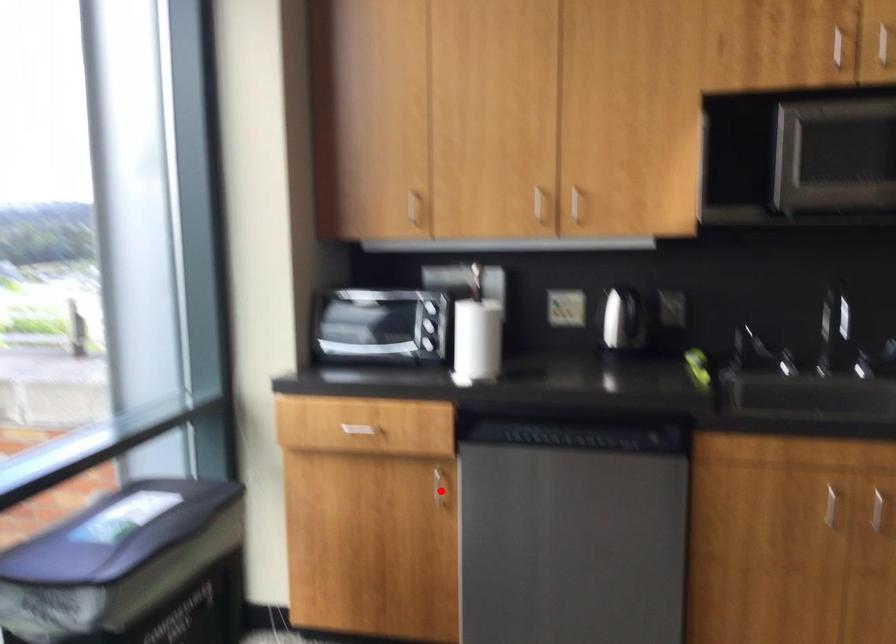
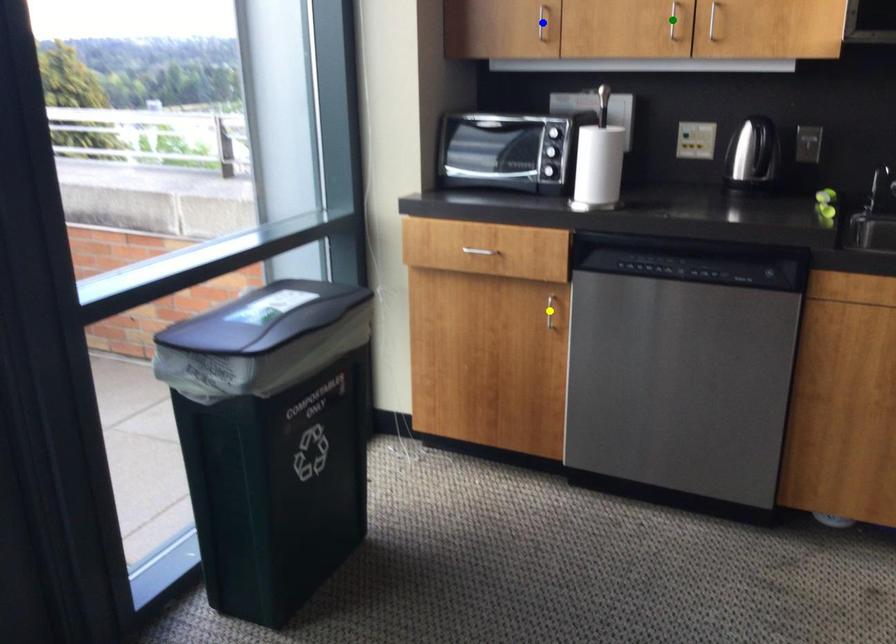
Question: I am providing you with two images of the same scene from different viewpoints. A red point is marked on the first image. You are given multiple points on the second image. Which point in image 2 represents the same 3d spot as the red point in image 1?

Choices:
 (A) yellow point
 (B) blue point
 (C) green point

Answer: (A)